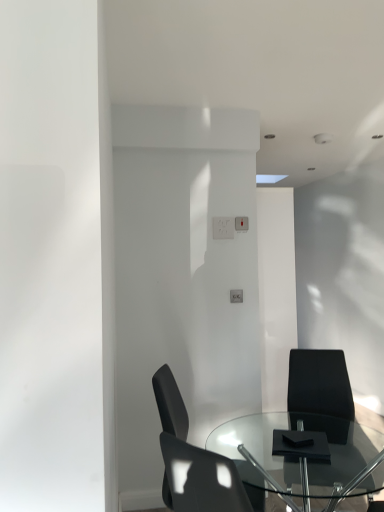
This screenshot has width=384, height=512. Describe the element at coordinates (319, 383) in the screenshot. I see `black matte chair at lower right, placed as the 2th chair when sorted from left to right` at that location.

Find the location of a particular element. black matte chair at lower right, placed as the 2th chair when sorted from left to right is located at coordinates (319, 383).

Relative to matte black chair at lower center, arranged as the 1th chair when viewed from the left, is transparent glass table at center in front or behind?

Clearly, transparent glass table at center is in front of matte black chair at lower center, arranged as the 1th chair when viewed from the left.

From a real-world perspective, is transparent glass table at center above or below matte black chair at lower center, which is the 2th chair in right-to-left order?

From a real-world perspective, transparent glass table at center is physically below matte black chair at lower center, which is the 2th chair in right-to-left order.

Considering the sizes of objects transparent glass table at center and matte black chair at lower center, arranged as the 1th chair when viewed from the left, in the image provided, who is taller, transparent glass table at center or matte black chair at lower center, arranged as the 1th chair when viewed from the left,?

With more height is matte black chair at lower center, arranged as the 1th chair when viewed from the left.

Between black matte chair at lower right, placed as the 2th chair when sorted from left to right, and matte black chair at lower center, which is the 2th chair in right-to-left order, which one appears on the right side from the viewer's perspective?

Positioned to the right is black matte chair at lower right, placed as the 2th chair when sorted from left to right.

Is matte black chair at lower center, which is the 2th chair in right-to-left order, a part of black matte chair at lower right, placed as the 2th chair when sorted from left to right?

Definitely not — matte black chair at lower center, which is the 2th chair in right-to-left order, is not inside black matte chair at lower right, placed as the 2th chair when sorted from left to right.

How much distance is there between black matte chair at lower right, acting as the first chair starting from the right, and matte black chair at lower center, which is the 2th chair in right-to-left order?

black matte chair at lower right, acting as the first chair starting from the right, is 1.06 meters from matte black chair at lower center, which is the 2th chair in right-to-left order.

Is black matte chair at lower right, placed as the 2th chair when sorted from left to right, closer to the viewer compared to matte black chair at lower center, which is the 2th chair in right-to-left order?

No, black matte chair at lower right, placed as the 2th chair when sorted from left to right, is further to the viewer.

How different are the orientations of transparent glass table at center and black matte chair at lower right, placed as the 2th chair when sorted from left to right, in degrees?

108 degrees.

In terms of height, does transparent glass table at center look taller or shorter compared to black matte chair at lower right, acting as the first chair starting from the right?

In the image, transparent glass table at center appears to be shorter than black matte chair at lower right, acting as the first chair starting from the right.

The height and width of the screenshot is (512, 384). In the image, there is a black matte chair at lower right, placed as the 2th chair when sorted from left to right. In order to click on table below it (from a real-world perspective) in this screenshot , I will do `click(299, 459)`.

From the image's perspective, is transparent glass table at center above black matte chair at lower right, acting as the first chair starting from the right?

No, from the image's perspective, transparent glass table at center is not on top of black matte chair at lower right, acting as the first chair starting from the right.

Considering the positions of point (160, 378) and point (298, 372), is point (160, 378) closer or farther from the camera than point (298, 372)?

Point (160, 378) appears to be closer to the viewer than point (298, 372).

From a real-world perspective, between matte black chair at lower center, which is the 2th chair in right-to-left order, and black matte chair at lower right, placed as the 2th chair when sorted from left to right, who is vertically lower?

In real-world perspective, black matte chair at lower right, placed as the 2th chair when sorted from left to right, is lower.

Considering the relative sizes of matte black chair at lower center, arranged as the 1th chair when viewed from the left, and black matte chair at lower right, placed as the 2th chair when sorted from left to right, in the image provided, is matte black chair at lower center, arranged as the 1th chair when viewed from the left, shorter than black matte chair at lower right, placed as the 2th chair when sorted from left to right,?

Yes.

Does matte black chair at lower center, which is the 2th chair in right-to-left order, lie behind black matte chair at lower right, placed as the 2th chair when sorted from left to right?

No, matte black chair at lower center, which is the 2th chair in right-to-left order, is closer to the viewer.

Is black matte chair at lower right, placed as the 2th chair when sorted from left to right, surrounding transparent glass table at center?

No, transparent glass table at center is not inside black matte chair at lower right, placed as the 2th chair when sorted from left to right.

Is black matte chair at lower right, placed as the 2th chair when sorted from left to right, closer to the viewer compared to transparent glass table at center?

No, black matte chair at lower right, placed as the 2th chair when sorted from left to right, is behind transparent glass table at center.

Which object is wider, black matte chair at lower right, placed as the 2th chair when sorted from left to right, or transparent glass table at center?

transparent glass table at center is wider.

Is point (322, 366) positioned behind point (276, 486)?

Yes, it is.

In the scene shown: Is matte black chair at lower center, arranged as the 1th chair when viewed from the left, surrounding transparent glass table at center?

No, transparent glass table at center is not a part of matte black chair at lower center, arranged as the 1th chair when viewed from the left.

From the image's perspective, which is above, matte black chair at lower center, arranged as the 1th chair when viewed from the left, or transparent glass table at center?

matte black chair at lower center, arranged as the 1th chair when viewed from the left.

Is point (222, 476) positioned after point (328, 466)?

That is False.

Between matte black chair at lower center, which is the 2th chair in right-to-left order, and transparent glass table at center, which one has larger size?

With larger size is transparent glass table at center.

I want to click on table that appears on the right of matte black chair at lower center, arranged as the 1th chair when viewed from the left, so click(x=299, y=459).

You are a GUI agent. You are given a task and a screenshot of the screen. Output one action in this format:
    pyautogui.click(x=<x>, y=<y>)
    Task: Click on the chair above the black matte chair at lower right, placed as the 2th chair when sorted from left to right (from the image's perspective)
    This screenshot has height=512, width=384.
    Given the screenshot: What is the action you would take?
    pyautogui.click(x=192, y=460)

Looking at the image, which one is located further to transparent glass table at center, black matte chair at lower right, acting as the first chair starting from the right, or matte black chair at lower center, arranged as the 1th chair when viewed from the left?

Based on the image, matte black chair at lower center, arranged as the 1th chair when viewed from the left, appears to be further to transparent glass table at center.

Looking at the image, which one is located closer to black matte chair at lower right, placed as the 2th chair when sorted from left to right, transparent glass table at center or matte black chair at lower center, which is the 2th chair in right-to-left order?

transparent glass table at center is positioned closer to the anchor black matte chair at lower right, placed as the 2th chair when sorted from left to right.

Which object lies nearer to the anchor point matte black chair at lower center, arranged as the 1th chair when viewed from the left, transparent glass table at center or black matte chair at lower right, placed as the 2th chair when sorted from left to right?

The object closer to matte black chair at lower center, arranged as the 1th chair when viewed from the left, is transparent glass table at center.

Based on their spatial positions, is black matte chair at lower right, acting as the first chair starting from the right, or transparent glass table at center closer to matte black chair at lower center, arranged as the 1th chair when viewed from the left?

transparent glass table at center.

Based on their spatial positions, is matte black chair at lower center, arranged as the 1th chair when viewed from the left, or transparent glass table at center further from black matte chair at lower right, placed as the 2th chair when sorted from left to right?

matte black chair at lower center, arranged as the 1th chair when viewed from the left.

Estimate the real-world distances between objects in this image. Which object is closer to transparent glass table at center, matte black chair at lower center, arranged as the 1th chair when viewed from the left, or black matte chair at lower right, acting as the first chair starting from the right?

black matte chair at lower right, acting as the first chair starting from the right, is positioned closer to the anchor transparent glass table at center.

What are the coordinates of `table between matte black chair at lower center, arranged as the 1th chair when viewed from the left, and black matte chair at lower right, placed as the 2th chair when sorted from left to right, from left to right` in the screenshot? It's located at (299, 459).